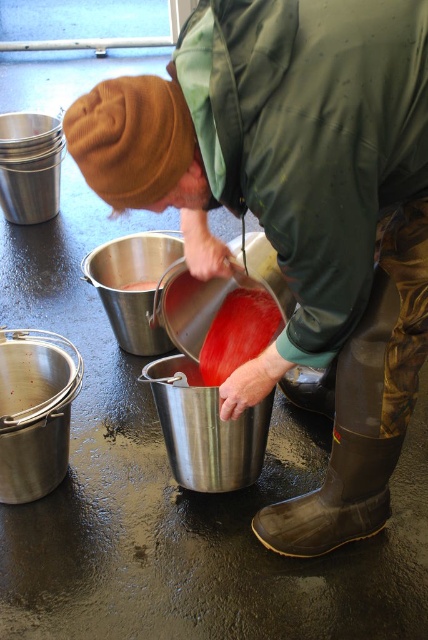
You are a worker in a food processing plant. You see a metallic bucket at center and a matte red liquid at center. Which object is located lower in the scene?

The metallic bucket at center is located below the matte red liquid at center, so the metallic bucket at center is lower than the matte red liquid at center.

You are a worker who needs to pour the bright red smooth liquid at center into the metallic bucket at center. Can you do this without moving either object?

The metallic bucket at center is closer to the viewer than the bright red smooth liquid at center, so you cannot pour the liquid into the bucket without moving them because the bucket is in front of the liquid.